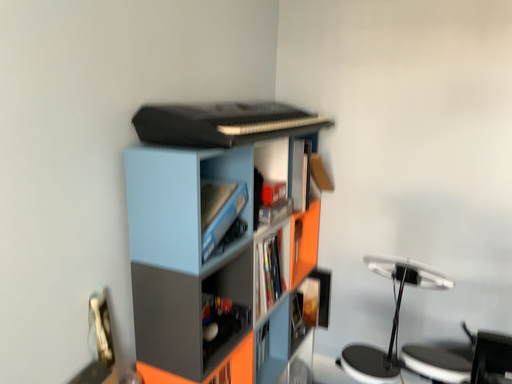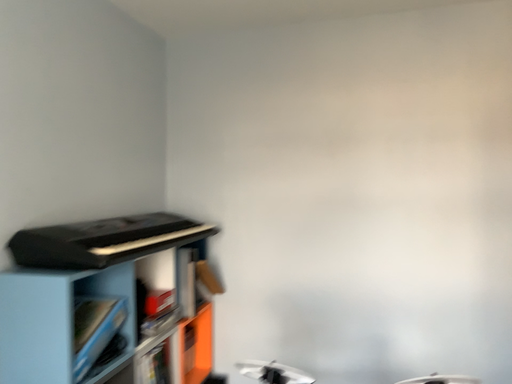
Question: Which way did the camera rotate in the video?

Choices:
 (A) rotated left
 (B) rotated right

Answer: (B)